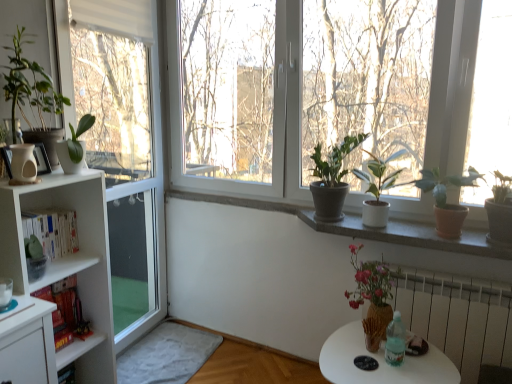
The width and height of the screenshot is (512, 384). Describe the element at coordinates (377, 188) in the screenshot. I see `green matte plant at center, the second houseplant when ordered from right to left` at that location.

The height and width of the screenshot is (384, 512). Find the location of `green matte plant at upper right, which is the first houseplant from right to left`. green matte plant at upper right, which is the first houseplant from right to left is located at coordinates (446, 200).

Describe the element at coordinates (34, 258) in the screenshot. I see `green matte plant at left, which appears as the 2th houseplant when viewed from the left` at that location.

I want to click on white radiator at lower right, so click(457, 317).

In order to click on green matte plant at center, the fifth houseplant viewed from the left in this screenshot , I will do `click(377, 188)`.

Is green matte plant at upper left, which appears as the first houseplant when viewed from the left, turned away from white concrete window sill at center?

No, green matte plant at upper left, which appears as the first houseplant when viewed from the left, is not facing the opposite direction of white concrete window sill at center.

Consider the image. Between green matte plant at upper left, which appears as the first houseplant when viewed from the left, and white concrete window sill at center, which one appears on the left side from the viewer's perspective?

green matte plant at upper left, which appears as the first houseplant when viewed from the left.

Considering the positions of objects green matte plant at upper left, which appears as the first houseplant when viewed from the left, and white concrete window sill at center in the image provided, who is in front, green matte plant at upper left, which appears as the first houseplant when viewed from the left, or white concrete window sill at center?

green matte plant at upper left, which appears as the first houseplant when viewed from the left.

In order to click on window frame on the left side of green matte plant at center, which ranks as the 4th houseplant in left-to-right order in this screenshot , I will do `click(124, 124)`.

Is green matte plant at center, which ranks as the 4th houseplant in left-to-right order, spatially inside white plastic window frame at left, or outside of it?

A: green matte plant at center, which ranks as the 4th houseplant in left-to-right order, is outside white plastic window frame at left.

Based on their sizes in the image, would you say green matte plant at center, the 3th houseplant from the right, is bigger or smaller than white plastic window frame at left?

In the image, green matte plant at center, the 3th houseplant from the right, appears to be smaller than white plastic window frame at left.

Is white glossy table at lower right positioned far away from white plastic window frame at left?

Yes, white glossy table at lower right and white plastic window frame at left are quite far apart.

Image resolution: width=512 pixels, height=384 pixels. I want to click on window frame above the white glossy table at lower right (from a real-world perspective), so click(124, 124).

From a real-world perspective, is white glossy table at lower right over white plastic window frame at left?

No, from a real-world perspective, white glossy table at lower right is not over white plastic window frame at left

In terms of height, does white glossy table at lower right look taller or shorter compared to white plastic window frame at left?

Considering their sizes, white glossy table at lower right has less height than white plastic window frame at left.

From a real-world perspective, which object stands above the other?

In real-world perspective, green matte plant at left, the 3th houseplant when ordered from left to right, is above.

Considering the sizes of objects green matte plant at center, the second houseplant when ordered from right to left, and green matte plant at left, the 3th houseplant when ordered from left to right, in the image provided, who is shorter, green matte plant at center, the second houseplant when ordered from right to left, or green matte plant at left, the 3th houseplant when ordered from left to right,?

Standing shorter between the two is green matte plant at left, the 3th houseplant when ordered from left to right.

Could you measure the distance between green matte plant at center, the fifth houseplant viewed from the left, and green matte plant at left, the 3th houseplant when ordered from left to right?

green matte plant at center, the fifth houseplant viewed from the left, is 1.31 meters away from green matte plant at left, the 3th houseplant when ordered from left to right.

Is green matte plant at center, the second houseplant when ordered from right to left, not close to green matte plant at left, marked as the 4th houseplant in a right-to-left arrangement?

Indeed, green matte plant at center, the second houseplant when ordered from right to left, is not near green matte plant at left, marked as the 4th houseplant in a right-to-left arrangement.

Is white radiator at lower right positioned with its back to white soft carpet at lower left?

No, white radiator at lower right's orientation is not away from white soft carpet at lower left.

Which is in front, white radiator at lower right or white soft carpet at lower left?

white radiator at lower right is closer to the camera.

Can you tell me how much white radiator at lower right and white soft carpet at lower left differ in facing direction?

The angle between the facing direction of white radiator at lower right and the facing direction of white soft carpet at lower left is 91.7 degrees.

Which object is positioned more to the right, white radiator at lower right or white soft carpet at lower left?

Positioned to the right is white radiator at lower right.

From the image's perspective, which one is positioned higher, green matte plant at left, which appears as the 2th houseplant when viewed from the left, or white radiator at lower right?

green matte plant at left, which appears as the 2th houseplant when viewed from the left, appears higher in the image.

Do you think green matte plant at left, positioned as the 5th houseplant in right-to-left order, is within white radiator at lower right, or outside of it?

green matte plant at left, positioned as the 5th houseplant in right-to-left order, is outside white radiator at lower right.

What are the coordinates of `radiator below the green matte plant at left, positioned as the 5th houseplant in right-to-left order (from the image's perspective)` in the screenshot? It's located at (457, 317).

Is the depth of green matte plant at left, which appears as the 2th houseplant when viewed from the left, greater than that of white radiator at lower right?

No.

From a real-world perspective, which is physically above, green matte plant at center, the 3th houseplant from the right, or hardcover books at left?

A: In real-world perspective, green matte plant at center, the 3th houseplant from the right, is above.

Is green matte plant at center, the 3th houseplant from the right, taller or shorter than hardcover books at left?

Considering their sizes, green matte plant at center, the 3th houseplant from the right, has more height than hardcover books at left.

Considering the relative sizes of green matte plant at center, the 3th houseplant from the right, and hardcover books at left in the image provided, is green matte plant at center, the 3th houseplant from the right, smaller than hardcover books at left?

Incorrect, green matte plant at center, the 3th houseplant from the right, is not smaller in size than hardcover books at left.

From the image's perspective, is green matte plant at center, the 3th houseplant from the right, under hardcover books at left?

No, from the image's perspective, green matte plant at center, the 3th houseplant from the right, is not below hardcover books at left.

Image resolution: width=512 pixels, height=384 pixels. Find the location of `window sill behind the green matte plant at upper left, which appears as the first houseplant when viewed from the left`. window sill behind the green matte plant at upper left, which appears as the first houseplant when viewed from the left is located at coordinates (408, 235).

Locate an element on the screen. This screenshot has width=512, height=384. window frame lying on the left of green matte plant at center, the 3th houseplant from the right is located at coordinates (124, 124).

Estimate the real-world distances between objects in this image. Which object is closer to green matte plant at upper right, placed as the sixth houseplant when sorted from left to right, white glossy table at lower right or green matte plant at left, positioned as the 5th houseplant in right-to-left order?

Based on the image, white glossy table at lower right appears to be nearer to green matte plant at upper right, placed as the sixth houseplant when sorted from left to right.

Which object lies further to the anchor point green matte plant at center, the fifth houseplant viewed from the left, matte brown vase with flowers at lower right or green matte plant at left, marked as the 4th houseplant in a right-to-left arrangement?

green matte plant at left, marked as the 4th houseplant in a right-to-left arrangement.

Considering their positions, is green matte plant at left, positioned as the 5th houseplant in right-to-left order, positioned closer to white soft carpet at lower left than hardcover books at left?

Based on the image, hardcover books at left appears to be nearer to white soft carpet at lower left.

Considering their positions, is green matte plant at left, marked as the 4th houseplant in a right-to-left arrangement, positioned further to green matte plant at upper left, which appears as the first houseplant when viewed from the left, than hardcover books at left?

hardcover books at left is positioned further to the anchor green matte plant at upper left, which appears as the first houseplant when viewed from the left.

Based on their spatial positions, is white soft carpet at lower left or green matte plant at upper left, which appears as the first houseplant when viewed from the left, closer to green matte plant at center, the 3th houseplant from the right?

Among the two, green matte plant at upper left, which appears as the first houseplant when viewed from the left, is located nearer to green matte plant at center, the 3th houseplant from the right.

Which object lies nearer to the anchor point hardcover books at left, white radiator at lower right or green matte plant at upper left, marked as the sixth houseplant in a right-to-left arrangement?

Among the two, green matte plant at upper left, marked as the sixth houseplant in a right-to-left arrangement, is located nearer to hardcover books at left.

From the image, which object appears to be farther from white plastic window frame at left, green matte plant at upper right, placed as the sixth houseplant when sorted from left to right, or green matte plant at left, positioned as the 5th houseplant in right-to-left order?

Based on the image, green matte plant at upper right, placed as the sixth houseplant when sorted from left to right, appears to be further to white plastic window frame at left.

From the image, which object appears to be nearer to white concrete window sill at center, green matte plant at left, the 3th houseplant when ordered from left to right, or white soft carpet at lower left?

white soft carpet at lower left is closer to white concrete window sill at center.

At what (x,y) coordinates should I click in order to perform the action: click on window sill located between matte white vase at left and white radiator at lower right in the left-right direction. Please return your answer as a coordinate pair (x, y). This screenshot has height=384, width=512. Looking at the image, I should click on (408, 235).

Identify the location of window frame between green matte plant at upper left, which appears as the first houseplant when viewed from the left, and white radiator at lower right, in the horizontal direction. This screenshot has height=384, width=512. (124, 124).

Locate an element on the screen. This screenshot has width=512, height=384. vase between hardcover books at left and matte brown vase with flowers at lower right in the horizontal direction is located at coordinates (23, 165).

This screenshot has width=512, height=384. What are the coordinates of `floral arrangement between hardcover books at left and green matte plant at center, the fifth houseplant viewed from the left` in the screenshot? It's located at (x=372, y=297).